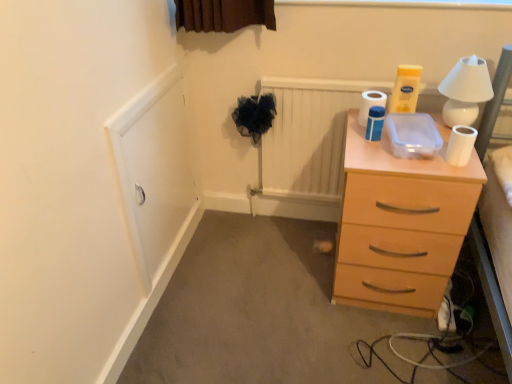
Question: Considering the relative sizes of light wood chest of drawers at right and white ceramic table lamp at upper right in the image provided, is light wood chest of drawers at right bigger than white ceramic table lamp at upper right?

Choices:
 (A) no
 (B) yes

Answer: (B)

Question: Is light wood chest of drawers at right placed right next to white ceramic table lamp at upper right?

Choices:
 (A) no
 (B) yes

Answer: (A)

Question: Is light wood chest of drawers at right taller than white ceramic table lamp at upper right?

Choices:
 (A) no
 (B) yes

Answer: (B)

Question: From the image's perspective, does light wood chest of drawers at right appear lower than white ceramic table lamp at upper right?

Choices:
 (A) yes
 (B) no

Answer: (A)

Question: From a real-world perspective, is light wood chest of drawers at right under white ceramic table lamp at upper right?

Choices:
 (A) yes
 (B) no

Answer: (A)

Question: Does point (372, 160) appear closer or farther from the camera than point (458, 130)?

Choices:
 (A) farther
 (B) closer

Answer: (B)

Question: Is light wood chest of drawers at right to the left or to the right of white matte toilet paper at upper right, the first toilet paper viewed from the front, in the image?

Choices:
 (A) right
 (B) left

Answer: (B)

Question: In terms of height, does light wood chest of drawers at right look taller or shorter compared to white matte toilet paper at upper right, positioned as the 1th toilet paper in right-to-left order?

Choices:
 (A) tall
 (B) short

Answer: (A)

Question: In terms of width, does light wood chest of drawers at right look wider or thinner when compared to white matte toilet paper at upper right, marked as the third toilet paper in a back-to-front arrangement?

Choices:
 (A) thin
 (B) wide

Answer: (B)

Question: Looking at their shapes, would you say white matte toilet paper at upper right, the 2th toilet paper from the back, is wider or thinner than white ceramic table lamp at upper right?

Choices:
 (A) wide
 (B) thin

Answer: (B)

Question: Is white matte toilet paper at upper right, arranged as the second toilet paper when viewed from the front, taller or shorter than white ceramic table lamp at upper right?

Choices:
 (A) short
 (B) tall

Answer: (A)

Question: From the image's perspective, is white matte toilet paper at upper right, the 1th toilet paper in the left-to-right sequence, positioned above or below white ceramic table lamp at upper right?

Choices:
 (A) below
 (B) above

Answer: (A)

Question: Considering the positions of point (373, 125) and point (449, 99), is point (373, 125) closer or farther from the camera than point (449, 99)?

Choices:
 (A) closer
 (B) farther

Answer: (B)

Question: Based on their sizes in the image, would you say white glossy toilet paper at upper right, the 1th toilet paper when ordered from back to front, is bigger or smaller than white matte toilet paper at upper right, the first toilet paper viewed from the front?

Choices:
 (A) small
 (B) big

Answer: (B)

Question: From the image's perspective, is white glossy toilet paper at upper right, acting as the second toilet paper starting from the right, above or below white matte toilet paper at upper right, positioned as the 1th toilet paper in right-to-left order?

Choices:
 (A) above
 (B) below

Answer: (A)